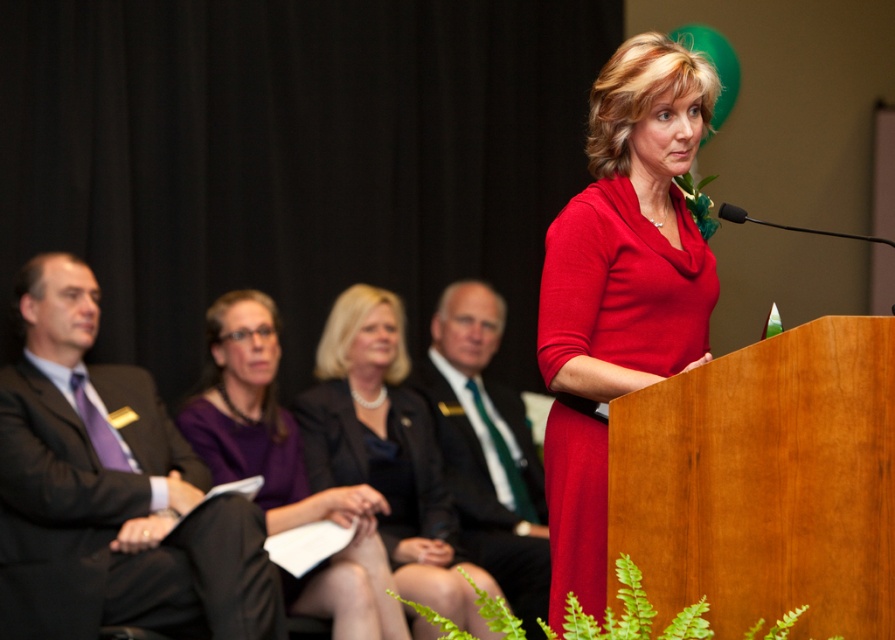
You are a photographer at the event and need to adjust the camera angle to ensure both the matte black suit at left and the matte black suit at center are fully visible in the frame. Based on their heights, which suit requires you to position the camera lower to avoid cropping the top?

The matte black suit at left has a lesser height compared to matte black suit at center. Therefore, to ensure both are fully visible, the camera should be positioned lower to accommodate the taller matte black suit at center, avoiding cropping its top.

You are taking a photo of the event scene. You want to focus on the point closer to the camera. Which point should you choose between point (195, 556) and point (442, 381)?

Point (195, 556) is closer to the camera than point (442, 381), so you should choose point (195, 556) to focus on.